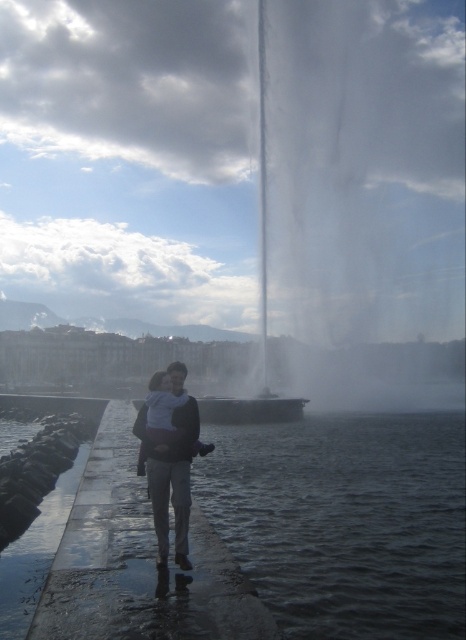
Question: Can you confirm if clear water at pier center is positioned to the left of white soft baby at center?

Choices:
 (A) yes
 (B) no

Answer: (B)

Question: Which of the following is the closest to the observer?

Choices:
 (A) (158, 406)
 (B) (141, 468)

Answer: (A)

Question: Can you confirm if clear water at pier center is positioned below matte black jacket at center?

Choices:
 (A) no
 (B) yes

Answer: (B)

Question: Among these points, which one is farthest from the camera?

Choices:
 (A) (172, 444)
 (B) (186, 595)

Answer: (A)

Question: Is clear water at pier center above white soft baby at center?

Choices:
 (A) no
 (B) yes

Answer: (A)

Question: Which of the following is the closest to the observer?

Choices:
 (A) (184, 541)
 (B) (176, 428)

Answer: (A)